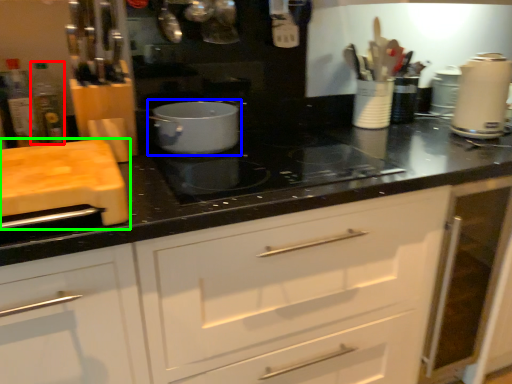
Question: Which object is positioned farthest from bottle (highlighted by a red box)? Select from kitchen appliance (highlighted by a blue box) and cutting board (highlighted by a green box).

Choices:
 (A) kitchen appliance
 (B) cutting board

Answer: (A)